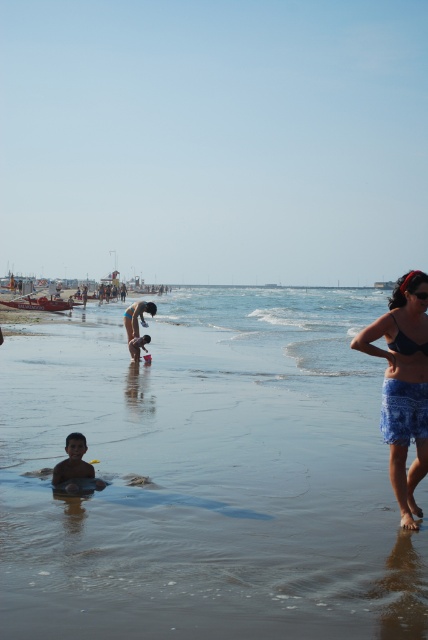
From the picture: Is matte black swimsuit at center to the right of smooth sand at lower center from the viewer's perspective?

No, matte black swimsuit at center is not to the right of smooth sand at lower center.

Can you confirm if matte black swimsuit at center is positioned below smooth sand at lower center?

No.

Who is more distant from viewer, (134, 310) or (146, 337)?

The point (146, 337) is behind.

Locate an element on the screen. matte black swimsuit at center is located at coordinates pos(136,316).

Between smooth skin child at lower left and matte black swimsuit at center, which one appears on the right side from the viewer's perspective?

Positioned to the right is smooth skin child at lower left.

Does smooth skin child at lower left come behind matte black swimsuit at center?

No, it is in front of matte black swimsuit at center.

This screenshot has width=428, height=640. Describe the element at coordinates (74, 465) in the screenshot. I see `smooth skin child at lower left` at that location.

I want to click on smooth skin child at lower left, so tap(74, 465).

Consider the image. Is blue printed skirt at lower right to the right of smooth skin child at lower left from the viewer's perspective?

Correct, you'll find blue printed skirt at lower right to the right of smooth skin child at lower left.

Can you confirm if blue printed skirt at lower right is shorter than smooth skin child at lower left?

No, blue printed skirt at lower right is not shorter than smooth skin child at lower left.

Between point (419, 304) and point (85, 472), which one is positioned in front?

Point (419, 304) is more forward.

This screenshot has width=428, height=640. What are the coordinates of `blue printed skirt at lower right` in the screenshot? It's located at (404, 385).